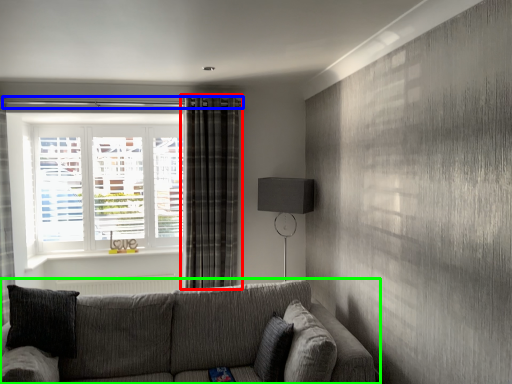
Question: Estimate the real-world distances between objects in this image. Which object is farther from curtain (highlighted by a red box), beam (highlighted by a blue box) or studio couch (highlighted by a green box)?

Choices:
 (A) beam
 (B) studio couch

Answer: (B)